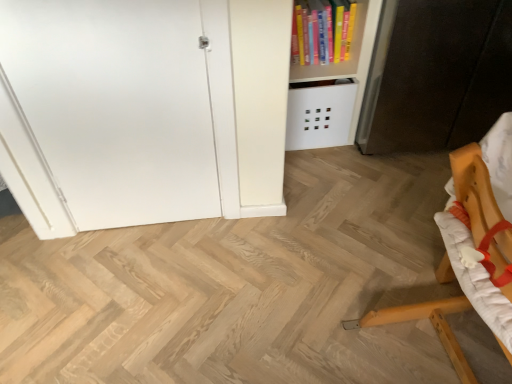
Where is `free point in front of dark brown wood cabinet at right`? free point in front of dark brown wood cabinet at right is located at coordinates (394, 211).